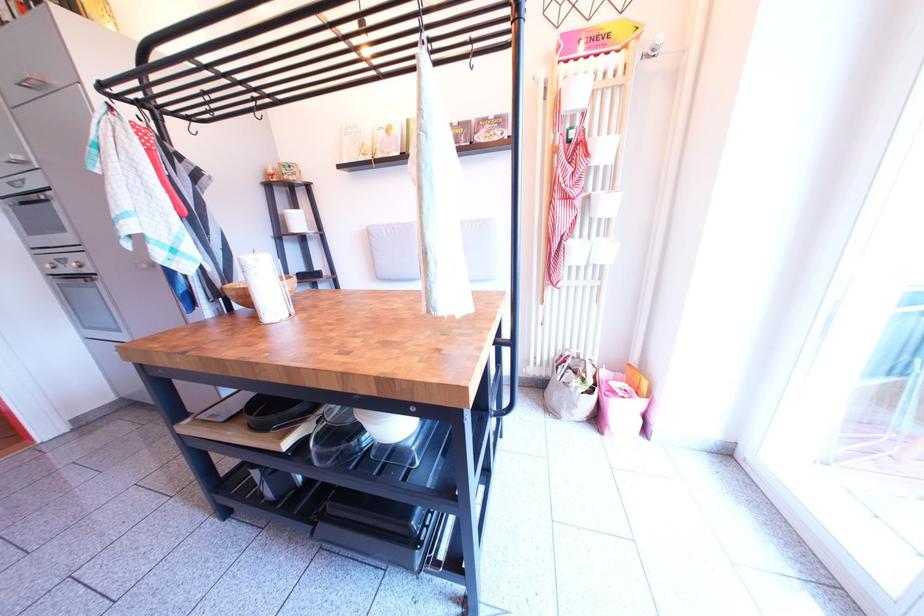
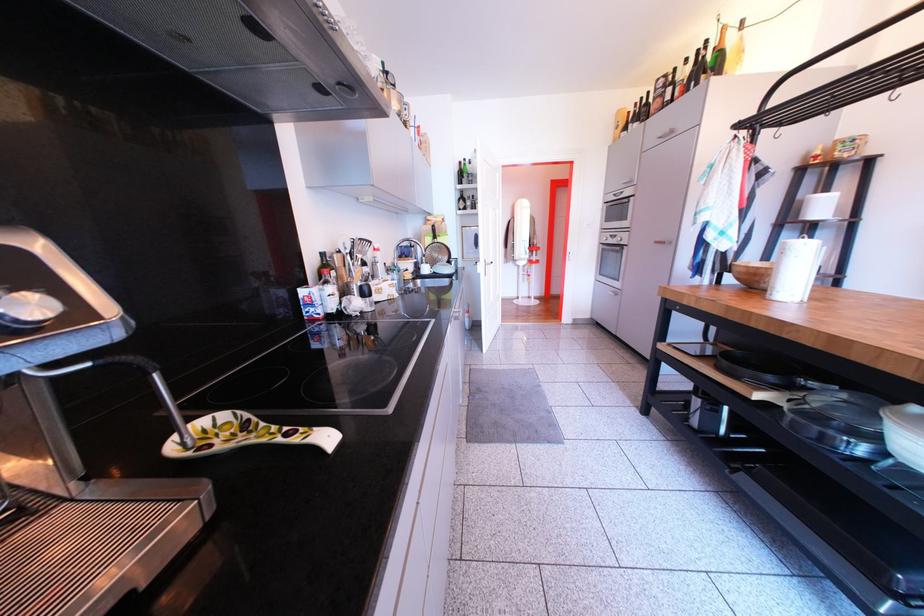
The point at [263,423] is marked in the first image. Where is the corresponding point in the second image?

(736, 369)